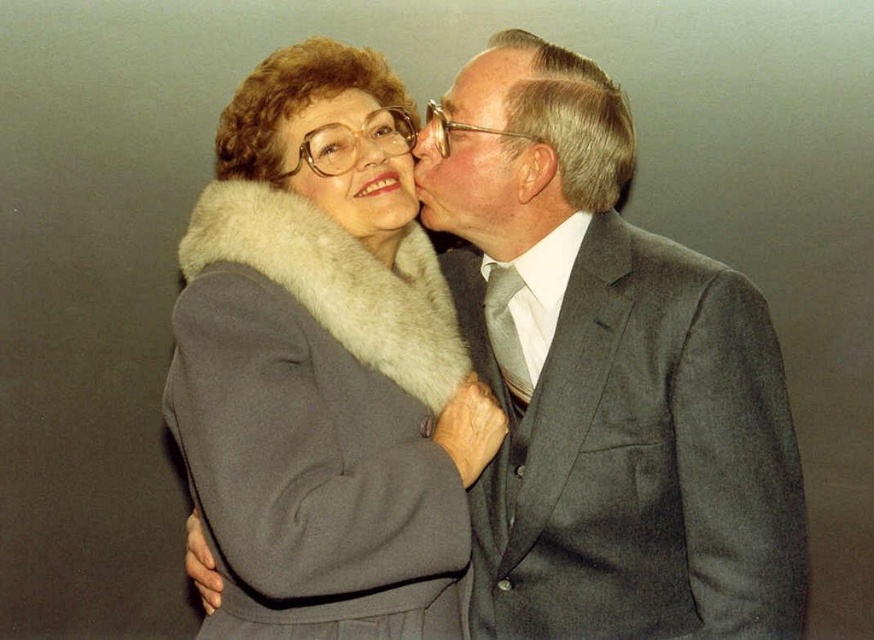
You are a photographer setting up for a portrait session. You have a spotlight that can only illuminate an area within a circle of radius 0.3 centered at point 0.5, 0.5. Will the gray wool suit at center be fully illuminated by the spotlight?

The gray wool suit at center is located at point (x=607, y=378). The distance from the center of the spotlight at (x=437, y=320) to the suit is sqrt 0.092 squared plus 0.196 squared equals approximately 0.213. Since 0.213 is less than 0.3, the suit will be fully illuminated.

Based on the scene description, where is the gray wool coat with fur collar at center located in the image?

The gray wool coat with fur collar at center is located at the center of the image at coordinates point (324, 365).